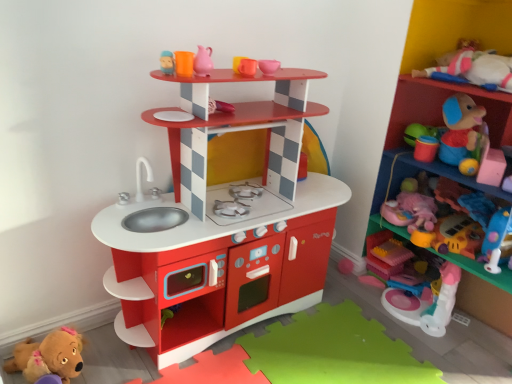
Question: From a real-world perspective, is plastic toy at upper right, the 1th shelf positioned from the right, on matte plastic shelf at upper center, marked as the second shelf in a right-to-left arrangement?

Choices:
 (A) no
 (B) yes

Answer: (B)

Question: Is plastic toy at upper right, the 1th shelf positioned from the right, aimed at matte plastic shelf at upper center, which is counted as the first shelf, starting from the left?

Choices:
 (A) no
 (B) yes

Answer: (A)

Question: Does plastic toy at upper right, the 1th shelf positioned from the right, have a lesser width compared to matte plastic shelf at upper center, marked as the second shelf in a right-to-left arrangement?

Choices:
 (A) no
 (B) yes

Answer: (A)

Question: Considering the relative sizes of plastic toy at upper right, the 1th shelf positioned from the right, and matte plastic shelf at upper center, which is counted as the first shelf, starting from the left, in the image provided, is plastic toy at upper right, the 1th shelf positioned from the right, bigger than matte plastic shelf at upper center, which is counted as the first shelf, starting from the left,?

Choices:
 (A) yes
 (B) no

Answer: (A)

Question: Is plastic toy at upper right, the 2th shelf viewed from the left, facing away from matte plastic shelf at upper center, which is counted as the first shelf, starting from the left?

Choices:
 (A) yes
 (B) no

Answer: (B)

Question: From the image's perspective, is plastic toy at upper right, the 1th shelf positioned from the right, located above or below pink rubber jug at upper center, the fourth toy viewed from the right?

Choices:
 (A) above
 (B) below

Answer: (B)

Question: Is plastic toy at upper right, the 2th shelf viewed from the left, bigger or smaller than pink rubber jug at upper center, placed as the 1th toy when sorted from top to bottom?

Choices:
 (A) small
 (B) big

Answer: (B)

Question: Considering the positions of point click(373, 216) and point click(202, 49), is point click(373, 216) closer or farther from the camera than point click(202, 49)?

Choices:
 (A) closer
 (B) farther

Answer: (B)

Question: In terms of height, does plastic toy at upper right, the 2th shelf viewed from the left, look taller or shorter compared to pink rubber jug at upper center, positioned as the 2th toy in left-to-right order?

Choices:
 (A) tall
 (B) short

Answer: (A)

Question: From the image's perspective, relative to plastic toy at upper right, the 1th shelf positioned from the right, is pink rubber jug at upper center, positioned as the 5th toy in bottom-to-top order, above or below?

Choices:
 (A) above
 (B) below

Answer: (A)

Question: Based on their sizes in the image, would you say pink rubber jug at upper center, positioned as the 5th toy in bottom-to-top order, is bigger or smaller than plastic toy at upper right, the 1th shelf positioned from the right?

Choices:
 (A) big
 (B) small

Answer: (B)

Question: Is pink rubber jug at upper center, positioned as the 2th toy in left-to-right order, to the left or to the right of plastic toy at upper right, the 1th shelf positioned from the right, in the image?

Choices:
 (A) left
 (B) right

Answer: (A)

Question: Is point click(x=210, y=64) closer or farther from the camera than point click(x=481, y=268)?

Choices:
 (A) farther
 (B) closer

Answer: (B)

Question: Is brown plush toy at lower left, placed as the 5th toy when sorted from top to bottom, in front of or behind plastic toy at upper right, the 2th shelf viewed from the left, in the image?

Choices:
 (A) front
 (B) behind

Answer: (B)

Question: From the image's perspective, is brown plush toy at lower left, the 1th toy when ordered from left to right, located above or below plastic toy at upper right, the 1th shelf positioned from the right?

Choices:
 (A) below
 (B) above

Answer: (A)